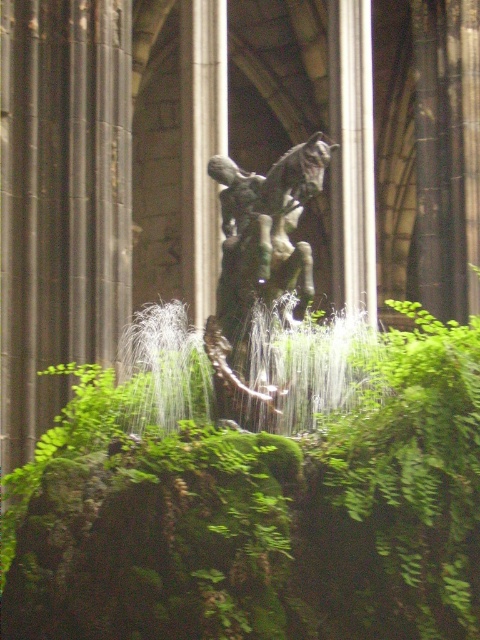
From the picture: Is green mossy rock at center shorter than green patina metal horse at center?

No, green mossy rock at center is not shorter than green patina metal horse at center.

Where is `green mossy rock at center`? This screenshot has width=480, height=640. green mossy rock at center is located at coordinates (261, 515).

Where is `green mossy rock at center`? green mossy rock at center is located at coordinates (261, 515).